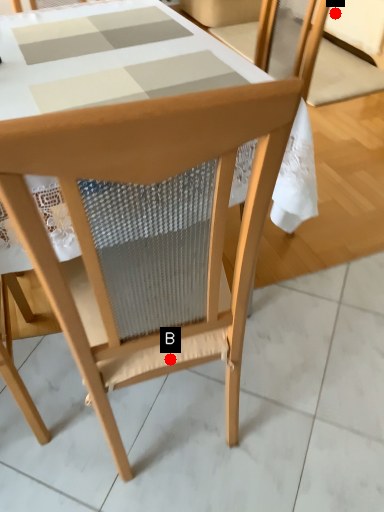
Question: Two points are circled on the image, labeled by A and B beside each circle. Which point is closer to the camera?

Choices:
 (A) A is closer
 (B) B is closer

Answer: (B)